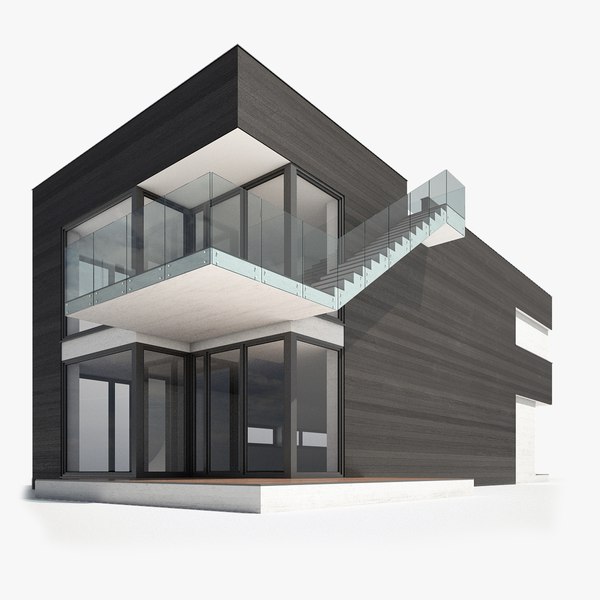
Where is `bottom left corner empty space`? This screenshot has height=600, width=600. bottom left corner empty space is located at coordinates (7, 596).